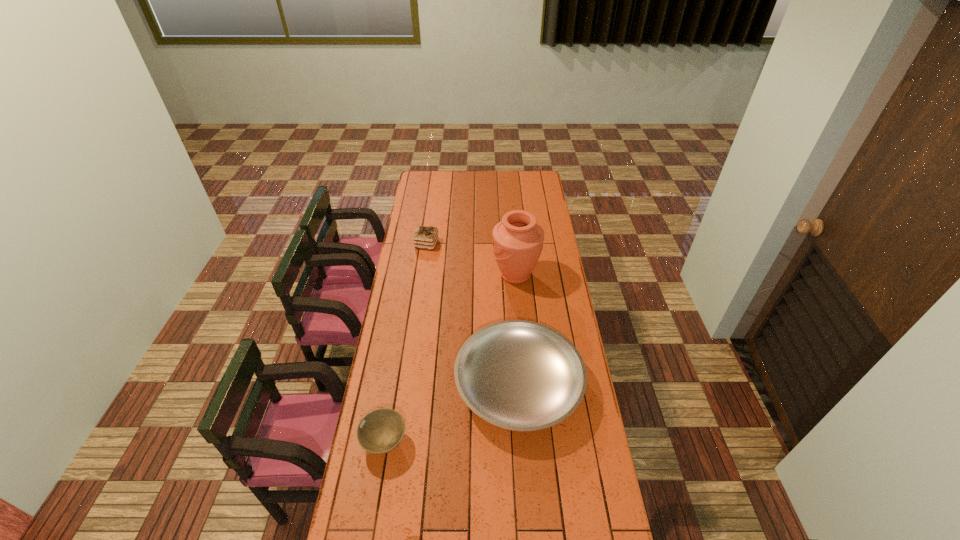
What are the coordinates of `bowl positioned at the left edge` in the screenshot? It's located at click(x=380, y=431).

This screenshot has width=960, height=540. Identify the location of vase present at the right edge. (518, 240).

Find the location of `bedpan that is at the right edge`. bedpan that is at the right edge is located at coordinates (520, 375).

Image resolution: width=960 pixels, height=540 pixels. What are the coordinates of `vacant region at the left edge of the desktop` in the screenshot? It's located at (411, 318).

Identify the location of vacant space at the right edge of the desktop. This screenshot has height=540, width=960. (528, 191).

This screenshot has height=540, width=960. In the image, there is a desktop. In order to click on vacant space at the far left corner in this screenshot , I will do `click(429, 179)`.

Find the location of a particular element. The image size is (960, 540). vacant space at the far right corner of the desktop is located at coordinates (541, 184).

Identify the location of free point between the bowl and the chocolate cake. This screenshot has width=960, height=540. (406, 343).

I want to click on empty space between the chocolate cake and the vase, so click(471, 260).

Image resolution: width=960 pixels, height=540 pixels. I want to click on free space between the tallest object and the farthest object, so click(471, 260).